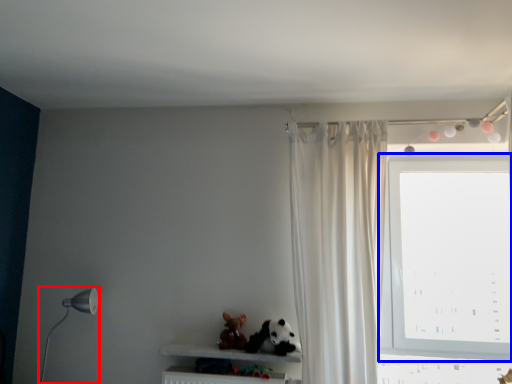
Question: Which object is further to the camera taking this photo, table lamp (highlighted by a red box) or window (highlighted by a blue box)?

Choices:
 (A) table lamp
 (B) window

Answer: (B)